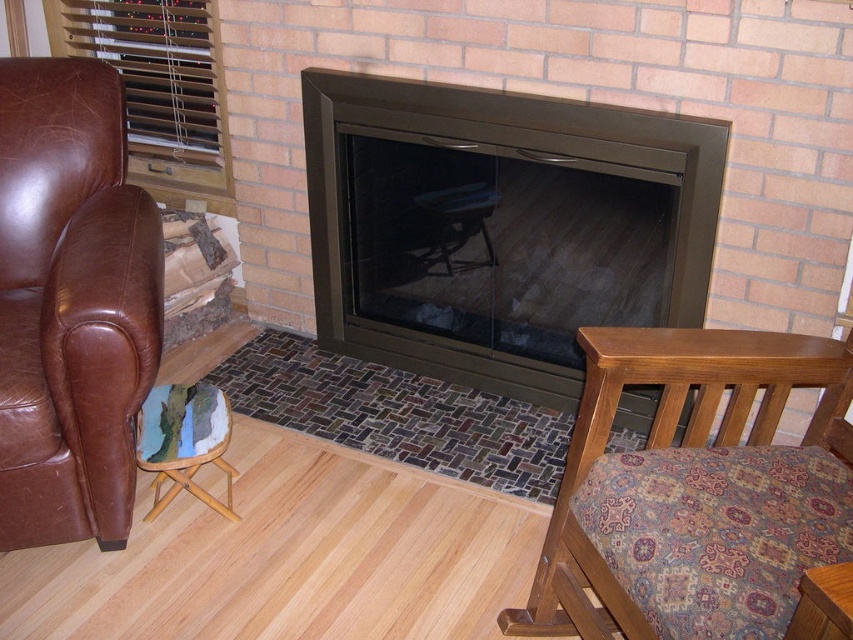
You are designing a room layout and need to place a tall floor lamp between the matte black fireplace at center and the light brown wood chair at lower right. Based on their heights, which object should the lamp be placed closer to?

The matte black fireplace at center is much taller than the light brown wood chair at lower right. Therefore, the tall floor lamp should be placed closer to the matte black fireplace at center to maintain visual balance.

You are standing at the point closest to the edge of the room and want to move towards the fireplace. Which of the two points, point (579, 125) or point (786, 636), is closer to the fireplace?

Point (579, 125) is behind point (786, 636), so point (786, 636) is closer to the fireplace.

You are planning to place a large rectangular coffee table in the center of the room. Considering the sizes of the brown leather armchair at left and the light brown wood chair at lower right, which chair would be more suitable to position closer to the table for comfort and space?

The brown leather armchair at left is larger in size compared to the light brown wood chair at lower right. Therefore, positioning the smaller light brown wood chair at lower right closer to the table would provide more comfortable seating and better utilize the available space.